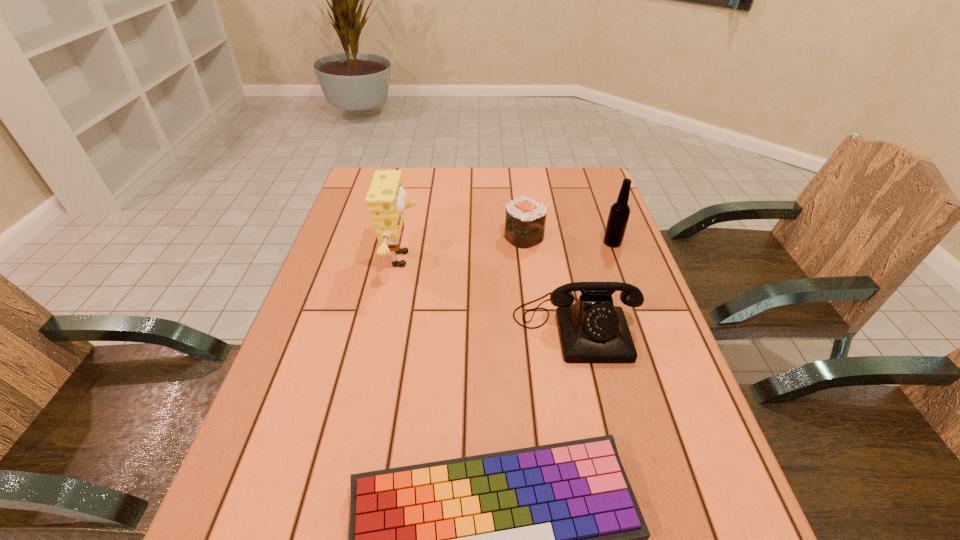
Where is `vacant space that is in between the second tallest object and the sushi`? The image size is (960, 540). vacant space that is in between the second tallest object and the sushi is located at coordinates (568, 240).

The image size is (960, 540). In order to click on vacant space that is in between the sponge and the sushi in this screenshot , I will do `click(464, 247)`.

Identify which object is the nearest to the sushi. Please provide its 2D coordinates. Your answer should be formatted as a tuple, i.e. [(x, y)], where the tuple contains the x and y coordinates of a point satisfying the conditions above.

[(619, 213)]

At what (x,y) coordinates should I click in order to perform the action: click on object identified as the third closest to the fourth shortest object. Please return your answer as a coordinate pair (x, y). The height and width of the screenshot is (540, 960). Looking at the image, I should click on (385, 199).

Locate an element on the screen. This screenshot has height=540, width=960. free space that satisfies the following two spatial constraints: 1. on the front side of the fourth shortest object; 2. on the front-facing side of the sponge is located at coordinates (618, 259).

This screenshot has width=960, height=540. Find the location of `vacant point that satisfies the following two spatial constraints: 1. on the front side of the fourth shortest object; 2. on the left side of the sushi`. vacant point that satisfies the following two spatial constraints: 1. on the front side of the fourth shortest object; 2. on the left side of the sushi is located at coordinates (525, 243).